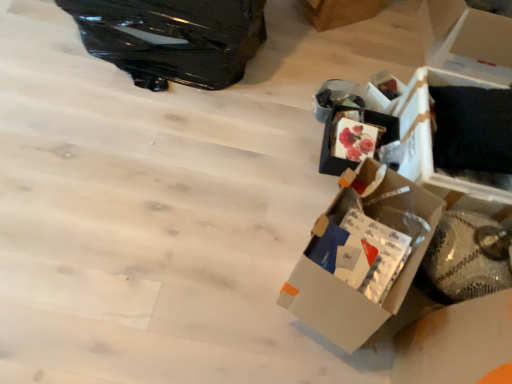
You are a GUI agent. You are given a task and a screenshot of the screen. Output one action in this format:
    pyautogui.click(x=<x>, y=<y>)
    Task: Click on the free spot to the right of white cardboard box at upper right, placed as the second cardboard box when sorted from right to left
    The height and width of the screenshot is (384, 512).
    Given the screenshot: What is the action you would take?
    pyautogui.click(x=388, y=32)